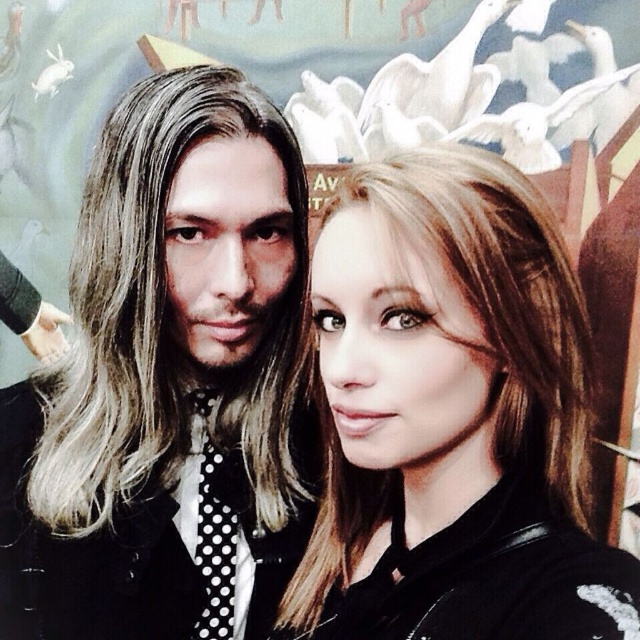
You are a photographer adjusting the lighting for a portrait. You notice two ties in the frame. Which tie is closer to the camera between the polka dot tie at center and the black dotted fabric tie at left?

The polka dot tie at center is closer to the camera because it is in front of the black dotted fabric tie at left.

You are designing a fashion layout and need to place two ties side by side. The polka dot tie at center and the black dotted fabric tie at left must be arranged so that the wider one is on the right side. Which tie should you place on the right?

The polka dot tie at center should be placed on the right side because its width is larger than the black dotted fabric tie at left.